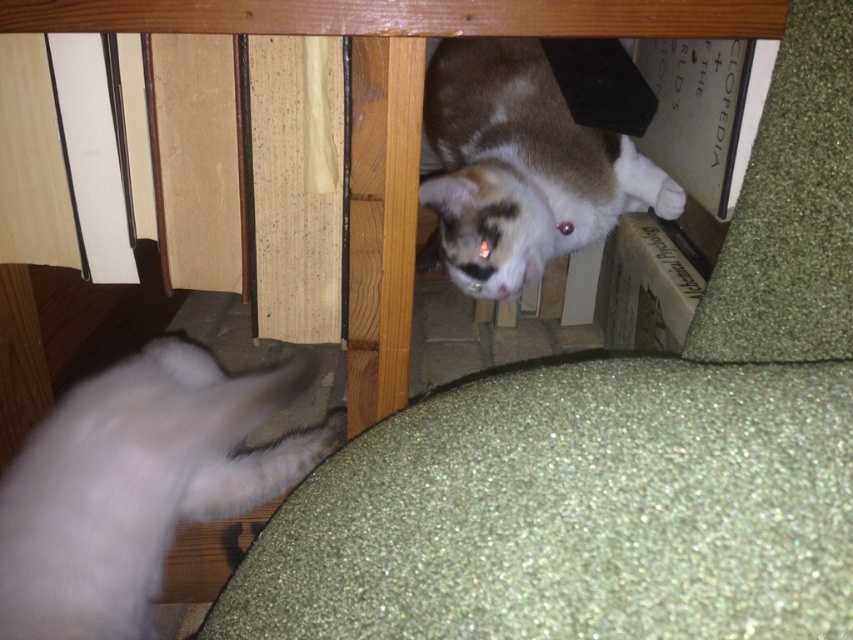
Question: Which object appears farthest from the camera in this image?

Choices:
 (A) white fluffy cat at lower left
 (B) calico fur cat at upper center

Answer: (B)

Question: Considering the relative positions of white fluffy cat at lower left and calico fur cat at upper center in the image provided, where is white fluffy cat at lower left located with respect to calico fur cat at upper center?

Choices:
 (A) left
 (B) right

Answer: (A)

Question: Does white fluffy cat at lower left lie behind calico fur cat at upper center?

Choices:
 (A) yes
 (B) no

Answer: (B)

Question: From the image, what is the correct spatial relationship of white fluffy cat at lower left in relation to calico fur cat at upper center?

Choices:
 (A) above
 (B) below

Answer: (B)